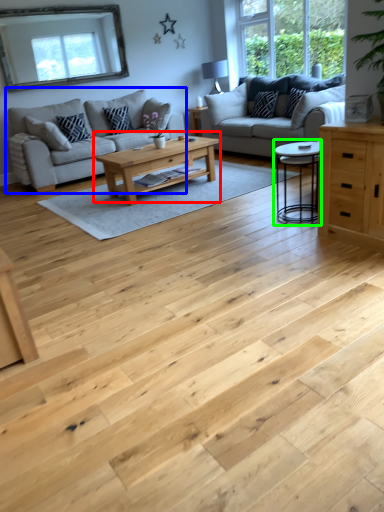
Question: Which object is the farthest from coffee table (highlighted by a red box)? Choose among these: studio couch (highlighted by a blue box) or coffee table (highlighted by a green box).

Choices:
 (A) studio couch
 (B) coffee table

Answer: (A)